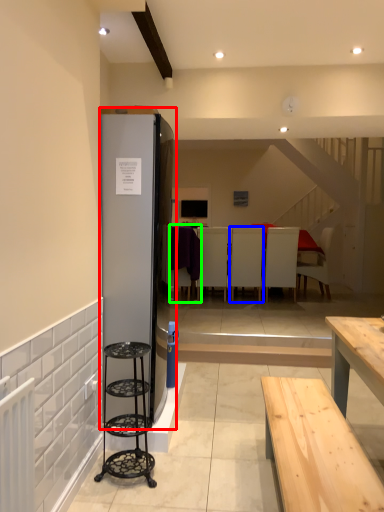
Question: Estimate the real-world distances between objects in this image. Which object is closer to fridge (highlighted by a red box), armchair (highlighted by a blue box) or armchair (highlighted by a green box)?

Choices:
 (A) armchair
 (B) armchair

Answer: (B)